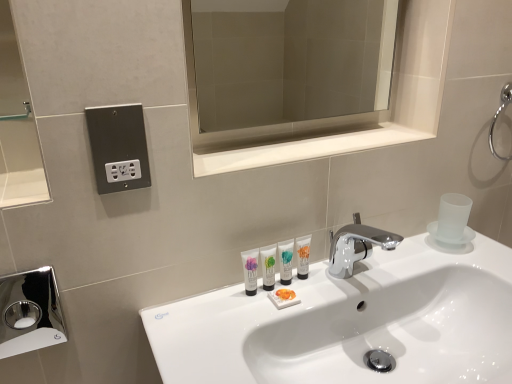
You are a GUI agent. You are given a task and a screenshot of the screen. Output one action in this format:
    pyautogui.click(x=<x>, y=<y>)
    Task: Click on the free location in front of white glossy tube at center, which is counted as the second mouthwash, starting from the right
    Image resolution: width=512 pixels, height=384 pixels.
    Given the screenshot: What is the action you would take?
    pyautogui.click(x=258, y=327)